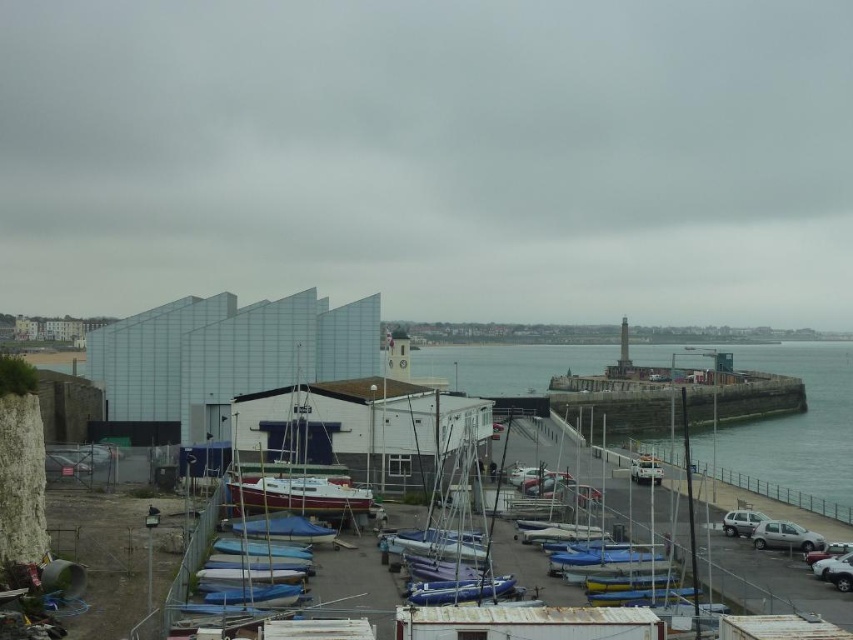
From the picture: You are standing at the modern building and want to walk to the lighthouse. There are two points marked on the path you need to choose between. The first point is at coordinate point (764, 369), and the second is at point (759, 516). Which point is closer to the lighthouse?

Point (759, 516) is closer to the lighthouse because point (764, 369) is behind it.

You are a delivery driver who needs to park your vehicle in the marina parking lot. You see the satin silver suv at lower right and the white matte van at center. Which vehicle is positioned closer to the marina entrance?

The satin silver suv at lower right is positioned closer to the marina entrance because it is below the white matte van at center, indicating it is lower in the image and likely closer to the entrance.